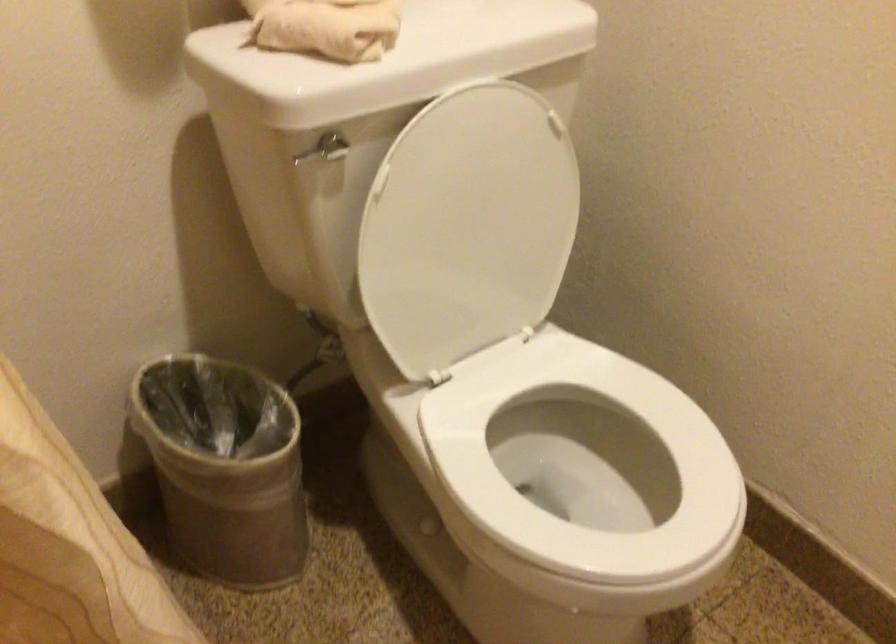
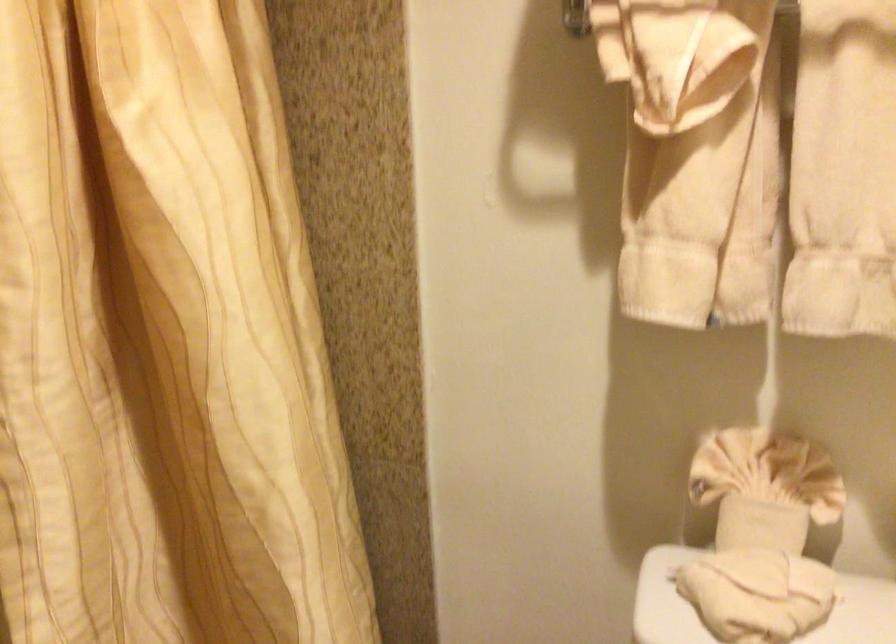
Question: The first image is from the beginning of the video and the second image is from the end. How did the camera likely rotate when shooting the video?

Choices:
 (A) Left
 (B) Right
 (C) Up
 (D) Down

Answer: (A)